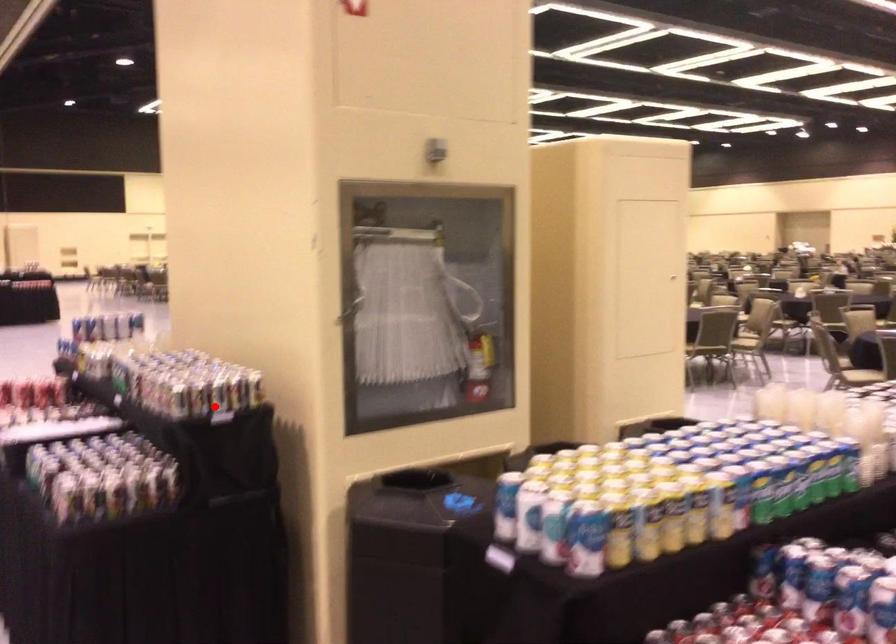
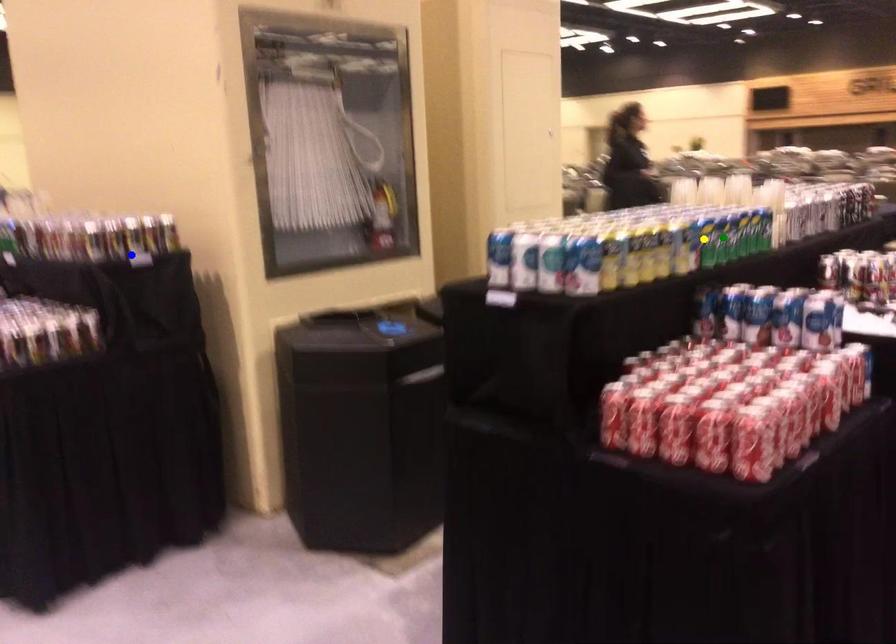
Question: I am providing you with two images of the same scene from different viewpoints. A red point is marked on the first image. You are given multiple points on the second image. Can you choose the point in image 2 that corresponds to the point in image 1?

Choices:
 (A) blue point
 (B) yellow point
 (C) green point

Answer: (A)